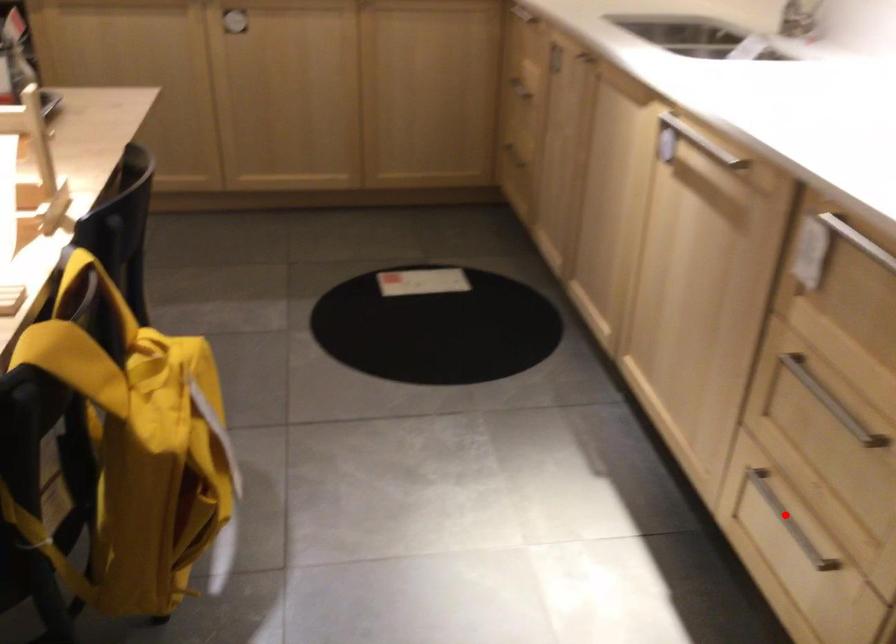
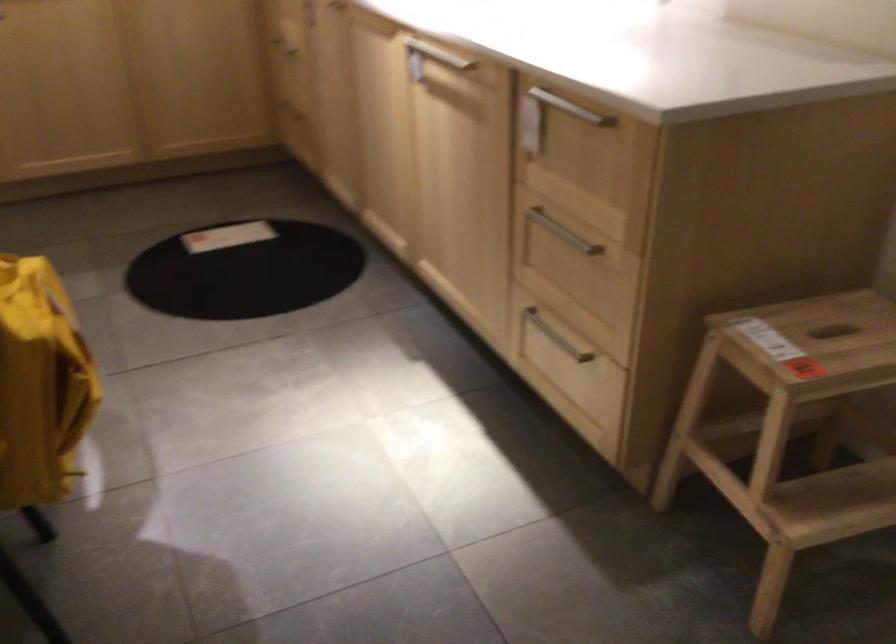
Find the pixel in the second image that matches the highlighted location in the first image.

(556, 337)